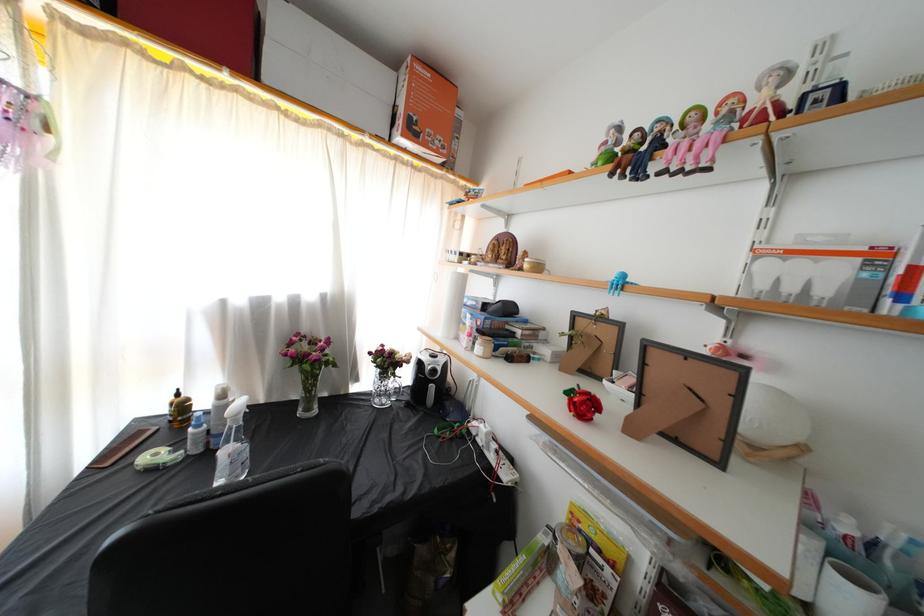
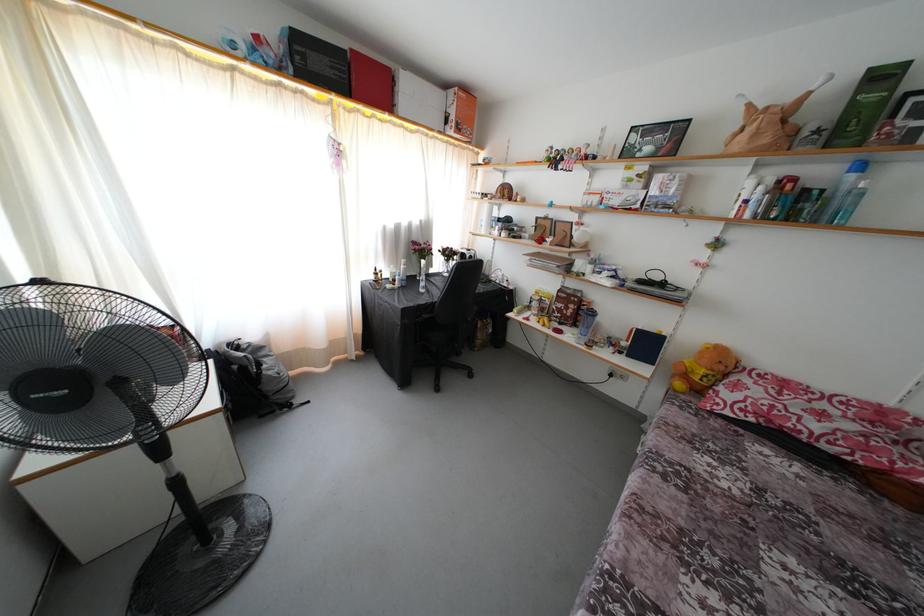
Locate, in the second image, the point that corresponds to point 295,369 in the first image.

(422, 259)